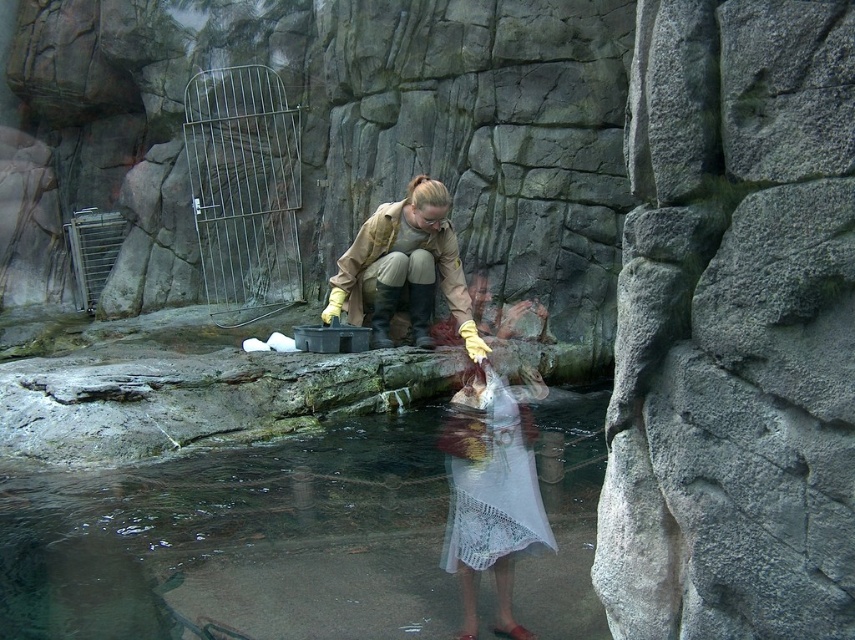
You are a zookeeper observing two items in the enclosure. You see the tan leather jacket at center and the white lace dress at lower center. Which item is closer to you?

The tan leather jacket at center is closer to you because it is further to the viewer than the white lace dress at lower center.

You are a zookeeper who needs to reach the clear water at lower center to collect a water sample. Your jacket, the tan leather jacket at center, is currently in the way. Can you move the jacket to access the water?

The clear water at lower center is shorter than the tan leather jacket at center, so moving the jacket might be necessary to access the water since the jacket is taller than the water area.